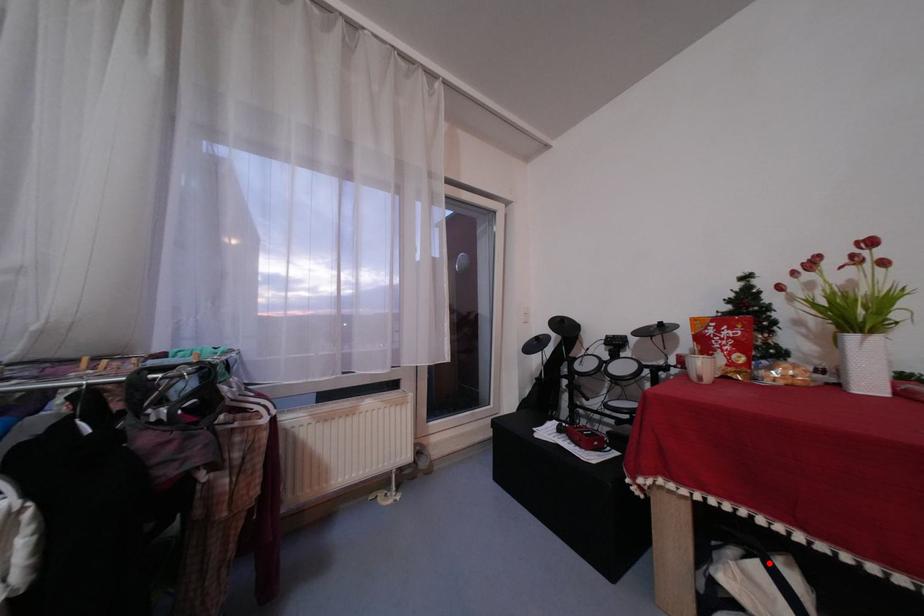
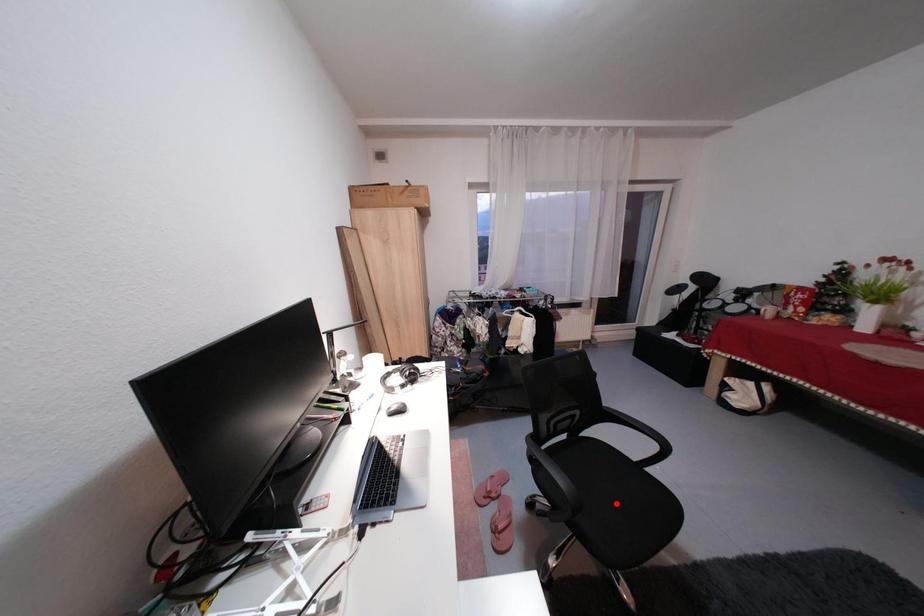
I am providing you with two images of the same scene from different viewpoints. A red point is marked on the first image and another point is marked on the second image. Is the red point in image1 aligned with the point shown in image2?

No